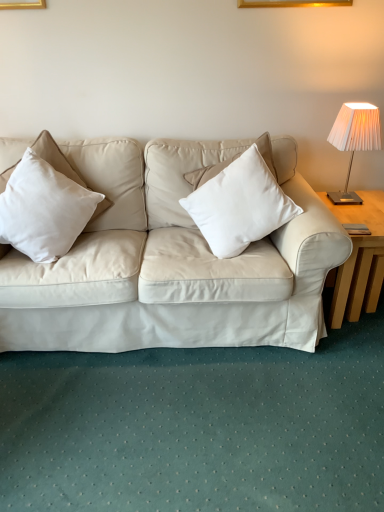
Question: Considering the relative positions of white cotton pillow at left, marked as the 2th pillow in a right-to-left arrangement, and white matte pillow at center, acting as the second pillow starting from the left, in the image provided, is white cotton pillow at left, marked as the 2th pillow in a right-to-left arrangement, behind white matte pillow at center, acting as the second pillow starting from the left,?

Choices:
 (A) yes
 (B) no

Answer: (B)

Question: From a real-world perspective, does white cotton pillow at left, marked as the 1th pillow in a left-to-right arrangement, sit lower than white matte pillow at center, acting as the second pillow starting from the left?

Choices:
 (A) yes
 (B) no

Answer: (A)

Question: Is white cotton pillow at left, marked as the 1th pillow in a left-to-right arrangement, closer to the viewer compared to white matte pillow at center, which is the first pillow from right to left?

Choices:
 (A) yes
 (B) no

Answer: (A)

Question: Is white cotton pillow at left, marked as the 2th pillow in a right-to-left arrangement, facing towards white matte pillow at center, acting as the second pillow starting from the left?

Choices:
 (A) yes
 (B) no

Answer: (B)

Question: From the image's perspective, is white cotton pillow at left, marked as the 2th pillow in a right-to-left arrangement, over white matte pillow at center, which is the first pillow from right to left?

Choices:
 (A) no
 (B) yes

Answer: (A)

Question: Considering the relative positions of white cotton pillow at left, marked as the 2th pillow in a right-to-left arrangement, and white matte pillow at center, which is the first pillow from right to left, in the image provided, is white cotton pillow at left, marked as the 2th pillow in a right-to-left arrangement, to the right of white matte pillow at center, which is the first pillow from right to left, from the viewer's perspective?

Choices:
 (A) no
 (B) yes

Answer: (A)

Question: Does white pleated fabric lampshade at upper right appear on the right side of light wood table at right?

Choices:
 (A) yes
 (B) no

Answer: (B)

Question: Is light wood table at right a part of white pleated fabric lampshade at upper right?

Choices:
 (A) yes
 (B) no

Answer: (B)

Question: Is white pleated fabric lampshade at upper right bigger than light wood table at right?

Choices:
 (A) yes
 (B) no

Answer: (B)

Question: Is white pleated fabric lampshade at upper right oriented away from light wood table at right?

Choices:
 (A) no
 (B) yes

Answer: (A)

Question: From the image's perspective, does white pleated fabric lampshade at upper right appear higher than light wood table at right?

Choices:
 (A) yes
 (B) no

Answer: (A)

Question: Is the surface of white pleated fabric lampshade at upper right in direct contact with light wood table at right?

Choices:
 (A) yes
 (B) no

Answer: (B)

Question: Does white cotton pillow at left, marked as the 2th pillow in a right-to-left arrangement, lie in front of white pleated fabric lampshade at upper right?

Choices:
 (A) yes
 (B) no

Answer: (A)